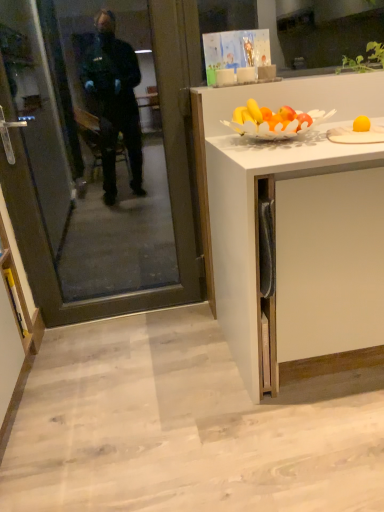
Question: Considering the relative positions of yellow matte plate at upper right and yellow marker at lower left, placed as the first cabinetry when sorted from left to right, in the image provided, is yellow matte plate at upper right to the left of yellow marker at lower left, placed as the first cabinetry when sorted from left to right, from the viewer's perspective?

Choices:
 (A) no
 (B) yes

Answer: (A)

Question: From the image's perspective, is yellow matte plate at upper right on yellow marker at lower left, placed as the first cabinetry when sorted from left to right?

Choices:
 (A) yes
 (B) no

Answer: (A)

Question: Considering the relative sizes of yellow matte plate at upper right and yellow marker at lower left, the second cabinetry when ordered from right to left, in the image provided, is yellow matte plate at upper right wider than yellow marker at lower left, the second cabinetry when ordered from right to left,?

Choices:
 (A) yes
 (B) no

Answer: (A)

Question: Is yellow matte plate at upper right outside yellow marker at lower left, the second cabinetry when ordered from right to left?

Choices:
 (A) no
 (B) yes

Answer: (B)

Question: From a real-world perspective, is yellow matte plate at upper right located beneath yellow marker at lower left, placed as the first cabinetry when sorted from left to right?

Choices:
 (A) yes
 (B) no

Answer: (B)

Question: Considering the relative positions of yellow matte plate at upper right and yellow marker at lower left, the second cabinetry when ordered from right to left, in the image provided, is yellow matte plate at upper right in front of yellow marker at lower left, the second cabinetry when ordered from right to left,?

Choices:
 (A) yes
 (B) no

Answer: (A)

Question: Can you confirm if transparent glass door at left is positioned to the right of yellow marker at lower left, the second cabinetry when ordered from right to left?

Choices:
 (A) no
 (B) yes

Answer: (B)

Question: Is transparent glass door at left not within yellow marker at lower left, placed as the first cabinetry when sorted from left to right?

Choices:
 (A) yes
 (B) no

Answer: (A)

Question: Can you confirm if transparent glass door at left is shorter than yellow marker at lower left, placed as the first cabinetry when sorted from left to right?

Choices:
 (A) yes
 (B) no

Answer: (B)

Question: Is transparent glass door at left turned away from yellow marker at lower left, the second cabinetry when ordered from right to left?

Choices:
 (A) yes
 (B) no

Answer: (B)

Question: Does transparent glass door at left lie in front of yellow marker at lower left, placed as the first cabinetry when sorted from left to right?

Choices:
 (A) no
 (B) yes

Answer: (B)

Question: Considering the relative sizes of transparent glass door at left and yellow marker at lower left, placed as the first cabinetry when sorted from left to right, in the image provided, is transparent glass door at left thinner than yellow marker at lower left, placed as the first cabinetry when sorted from left to right,?

Choices:
 (A) yes
 (B) no

Answer: (A)

Question: Can you confirm if white matte cabinet at right, arranged as the first cabinetry when viewed from the right, is positioned to the right of yellow marker at lower left, the second cabinetry when ordered from right to left?

Choices:
 (A) no
 (B) yes

Answer: (B)